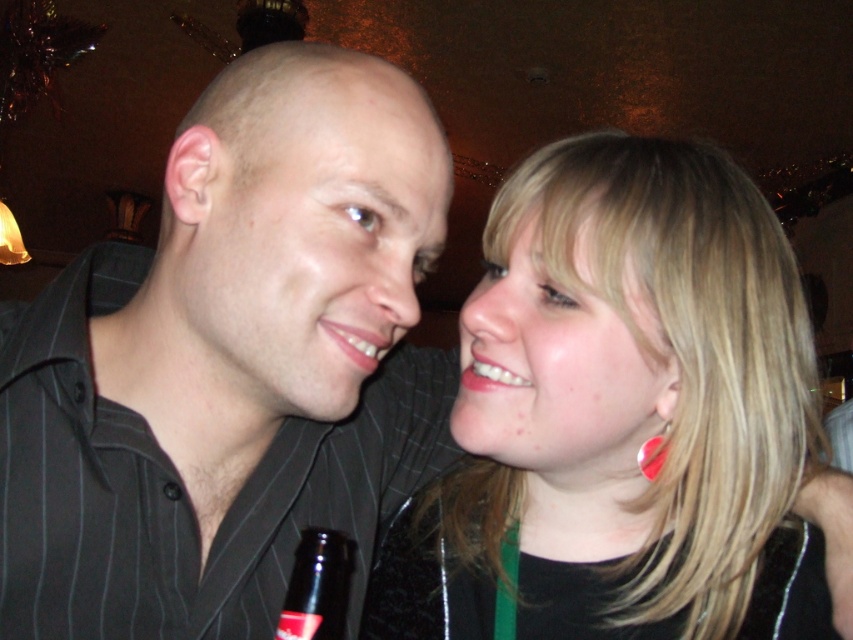
Question: Which point is closer to the camera taking this photo?

Choices:
 (A) (463, 381)
 (B) (706, 589)

Answer: (A)

Question: Can you confirm if matte pink lipstick at lower right is bigger than red glass earring at upper right?

Choices:
 (A) no
 (B) yes

Answer: (B)

Question: In this image, where is matte pink lipstick at center located relative to red glass earring at upper right?

Choices:
 (A) above
 (B) below

Answer: (A)

Question: Which point appears farthest from the camera in this image?

Choices:
 (A) (352, 333)
 (B) (666, 448)
 (C) (457, 492)

Answer: (C)

Question: Does black glass bottle at lower center appear on the left side of matte pink lipstick at lower right?

Choices:
 (A) yes
 (B) no

Answer: (A)

Question: Which point is closer to the camera?

Choices:
 (A) (355, 360)
 (B) (578, 200)
 (C) (160, 397)
 (D) (657, 435)

Answer: (A)